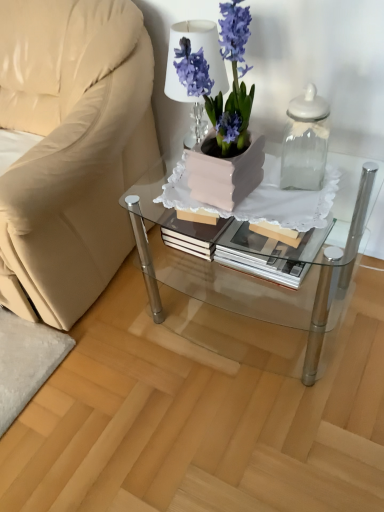
Question: Looking at their shapes, would you say clear glass coffee table at center is wider or thinner than beige fabric chair at left?

Choices:
 (A) wide
 (B) thin

Answer: (B)

Question: Is clear glass coffee table at center to the left or to the right of beige fabric chair at left in the image?

Choices:
 (A) right
 (B) left

Answer: (A)

Question: Considering the real-world distances, which object is closest to the beige fabric chair at left?

Choices:
 (A) clear glass jar at upper right
 (B) white glossy table lamp at upper center
 (C) clear glass coffee table at center
 (D) matte ceramic vase at center

Answer: (B)

Question: Which of these objects is positioned closest to the white glossy table lamp at upper center?

Choices:
 (A) beige fabric chair at left
 (B) clear glass coffee table at center
 (C) matte ceramic vase at center
 (D) clear glass jar at upper right

Answer: (C)